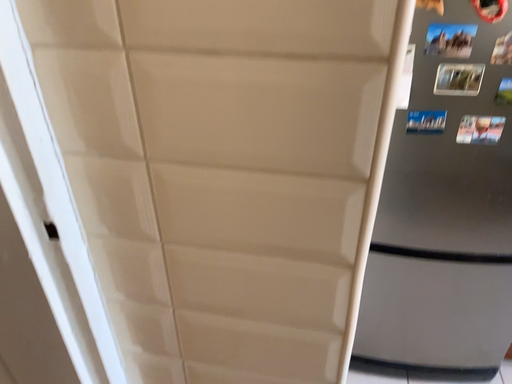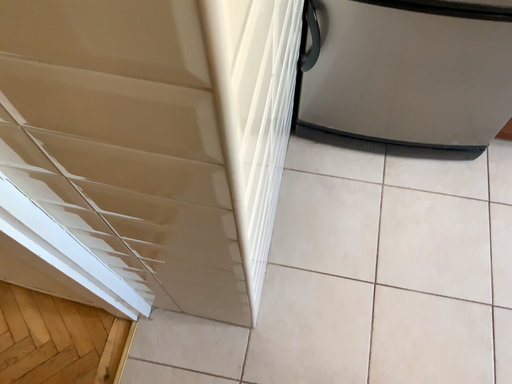
Question: How did the camera likely rotate when shooting the video?

Choices:
 (A) rotated downward
 (B) rotated upward

Answer: (A)